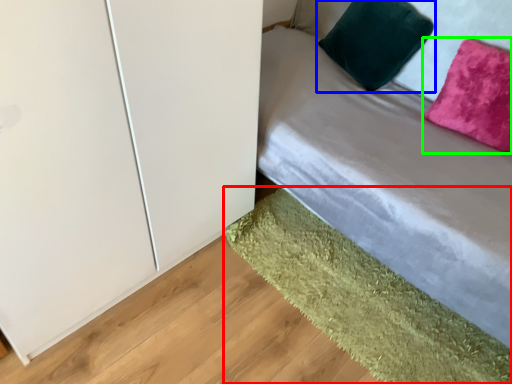
Question: Which object is the closest to the mat (highlighted by a red box)? Choose among these: pillow (highlighted by a blue box) or pillow (highlighted by a green box).

Choices:
 (A) pillow
 (B) pillow

Answer: (B)